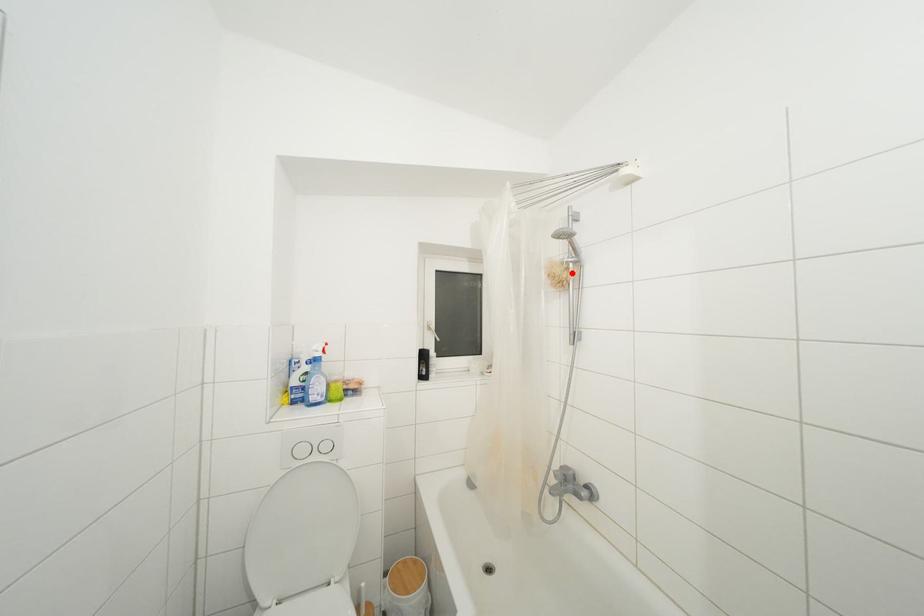
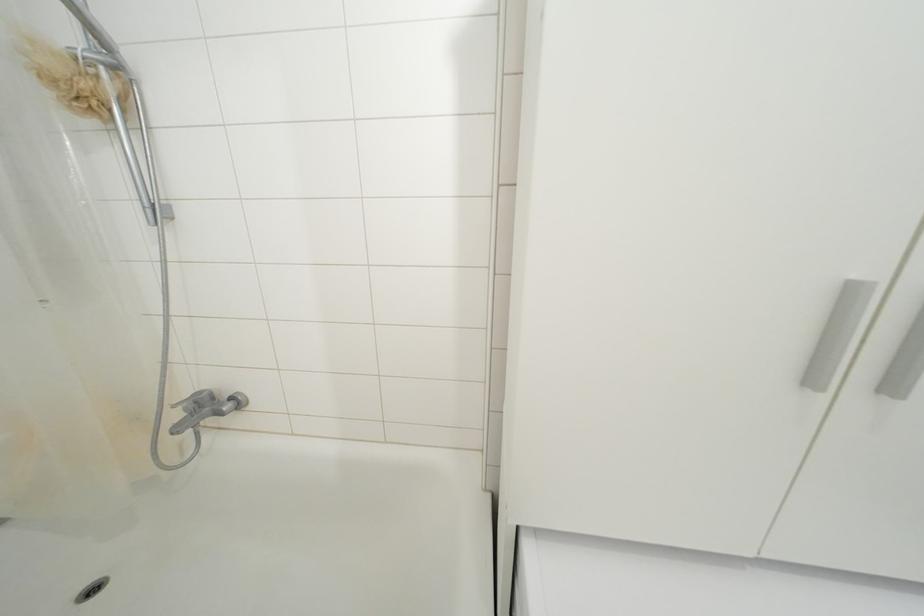
In the second image, find the point that corresponds to the highlighted location in the first image.

(100, 79)